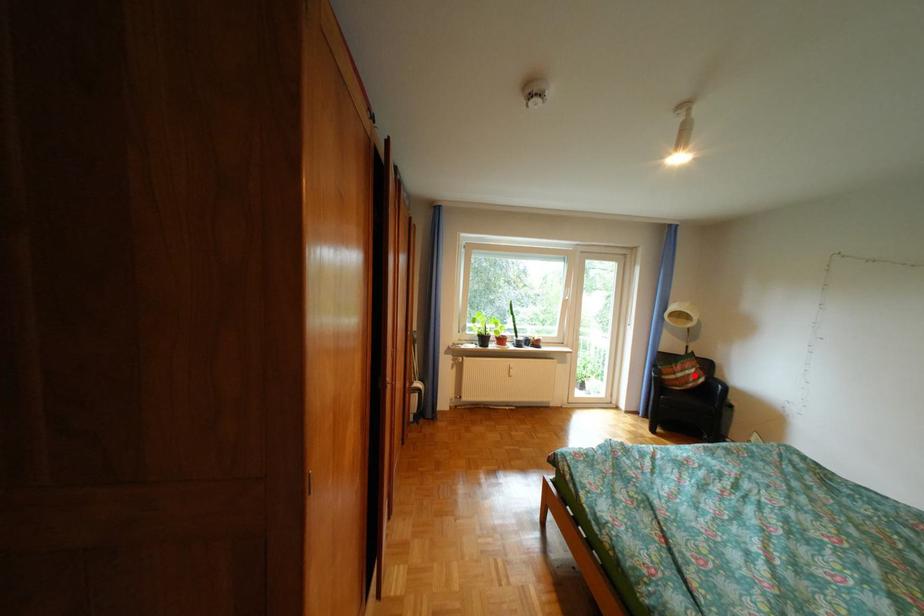
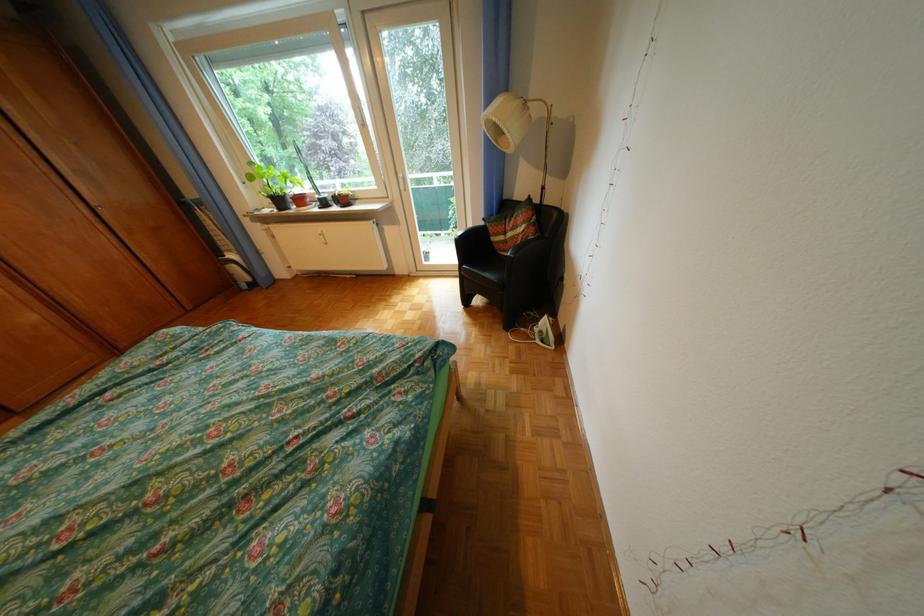
Question: I am providing you with two images of the same scene from different viewpoints. A red point is shown in image1. For the corresponding object point in image2, is it positioned nearer or farther from the camera?

Choices:
 (A) Nearer
 (B) Farther

Answer: (A)